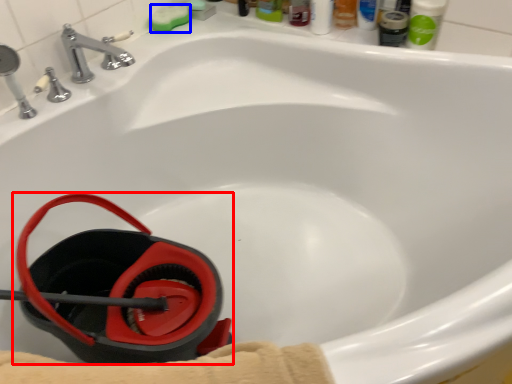
Question: Which point is further to the camera, job (highlighted by a red box) or soap (highlighted by a blue box)?

Choices:
 (A) job
 (B) soap

Answer: (B)